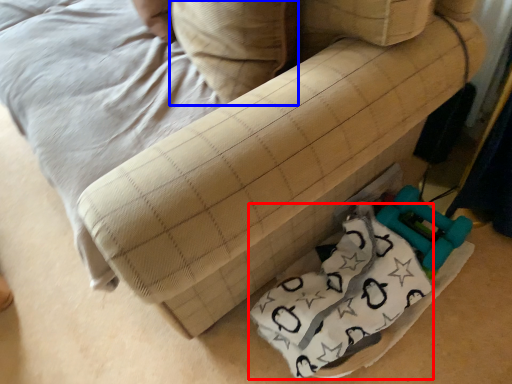
Question: Which object appears closest to the camera in this image, material (highlighted by a red box) or pillow (highlighted by a blue box)?

Choices:
 (A) material
 (B) pillow

Answer: (B)